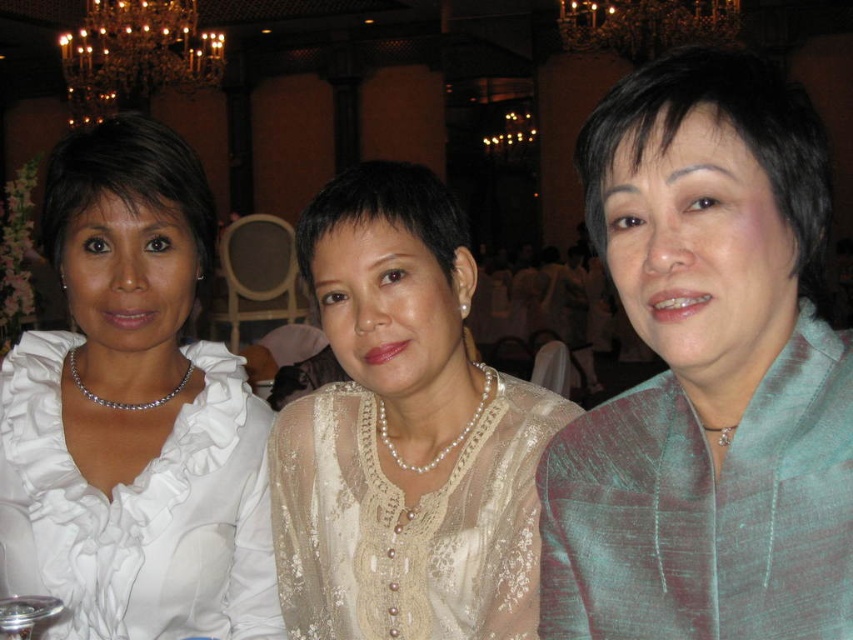
Who is taller, teal silk jacket at center or pearl lace blouse at center?

Standing taller between the two is pearl lace blouse at center.

Between point (556, 572) and point (393, 448), which one is positioned in front?

Positioned in front is point (556, 572).

What do you see at coordinates (706, 374) in the screenshot? The height and width of the screenshot is (640, 853). I see `teal silk jacket at center` at bounding box center [706, 374].

Identify the location of teal silk jacket at center. The width and height of the screenshot is (853, 640). (706, 374).

Does white satin blouse at left appear under pearl lace blouse at center?

Actually, white satin blouse at left is above pearl lace blouse at center.

Who is more forward, (73, 524) or (572, 413)?

Point (73, 524) is more forward.

Find the location of a particular element. white satin blouse at left is located at coordinates (132, 412).

Which is above, teal silk jacket at center or white satin blouse at left?

Positioned higher is teal silk jacket at center.

Is teal silk jacket at center positioned behind white satin blouse at left?

No, it is not.

Where is `teal silk jacket at center`? This screenshot has height=640, width=853. teal silk jacket at center is located at coordinates (706, 374).

Identify the location of teal silk jacket at center. The width and height of the screenshot is (853, 640). (706, 374).